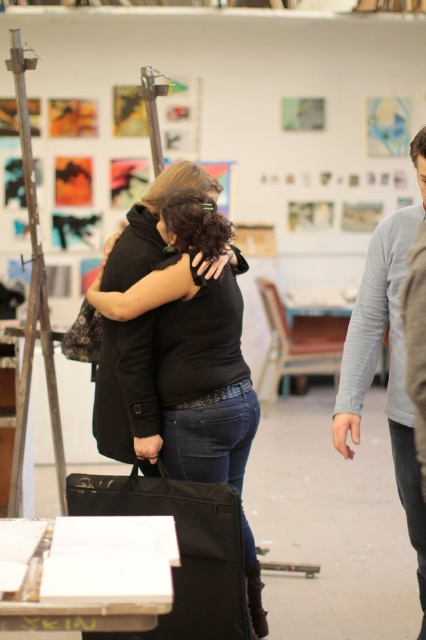
Between gray cotton sweater at right and black matte coat at center, which one appears on the left side from the viewer's perspective?

black matte coat at center is more to the left.

Which is above, gray cotton sweater at right or black matte coat at center?

black matte coat at center

This screenshot has width=426, height=640. What do you see at coordinates (389, 358) in the screenshot?
I see `gray cotton sweater at right` at bounding box center [389, 358].

The width and height of the screenshot is (426, 640). Find the location of `gray cotton sweater at right`. gray cotton sweater at right is located at coordinates (389, 358).